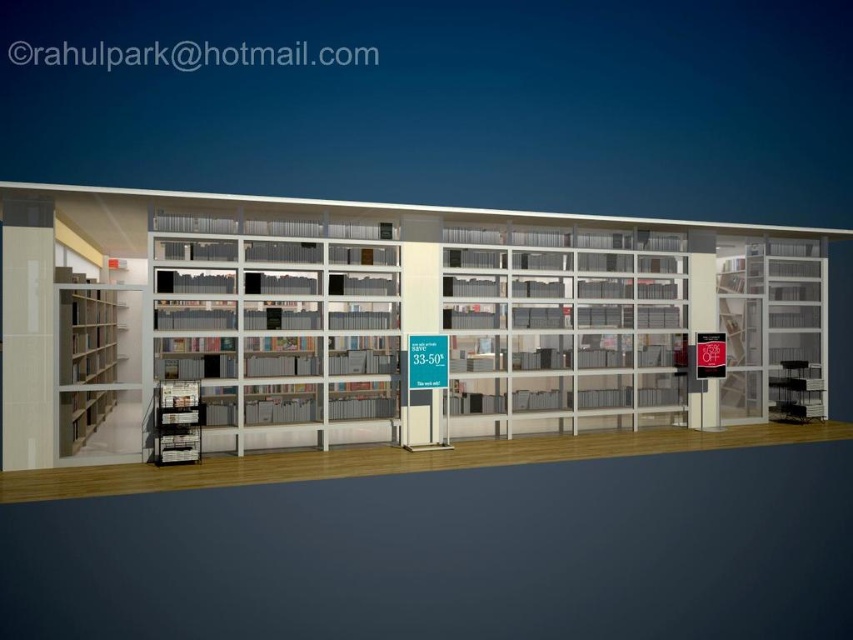
Who is positioned more to the left, white glossy bookcase at center or clear glass shelves at right?

white glossy bookcase at center

Where is `white glossy bookcase at center`? Image resolution: width=853 pixels, height=640 pixels. white glossy bookcase at center is located at coordinates (386, 316).

You are a GUI agent. You are given a task and a screenshot of the screen. Output one action in this format:
    pyautogui.click(x=<x>, y=<y>)
    Task: Click on the white glossy bookcase at center
    The width and height of the screenshot is (853, 640).
    Given the screenshot: What is the action you would take?
    pyautogui.click(x=386, y=316)

Can you confirm if white glossy bookcase at center is thinner than clear glass bookcase at center?

In fact, white glossy bookcase at center might be wider than clear glass bookcase at center.

Does white glossy bookcase at center appear under clear glass bookcase at center?

Indeed, white glossy bookcase at center is positioned under clear glass bookcase at center.

Is point (352, 397) behind point (368, 330)?

Yes, point (352, 397) is behind point (368, 330).

The height and width of the screenshot is (640, 853). I want to click on white glossy bookcase at center, so click(386, 316).

Is clear glass bookcase at center to the right of clear glass shelves at right from the viewer's perspective?

No, clear glass bookcase at center is not to the right of clear glass shelves at right.

Find the location of a particular element. clear glass bookcase at center is located at coordinates (279, 324).